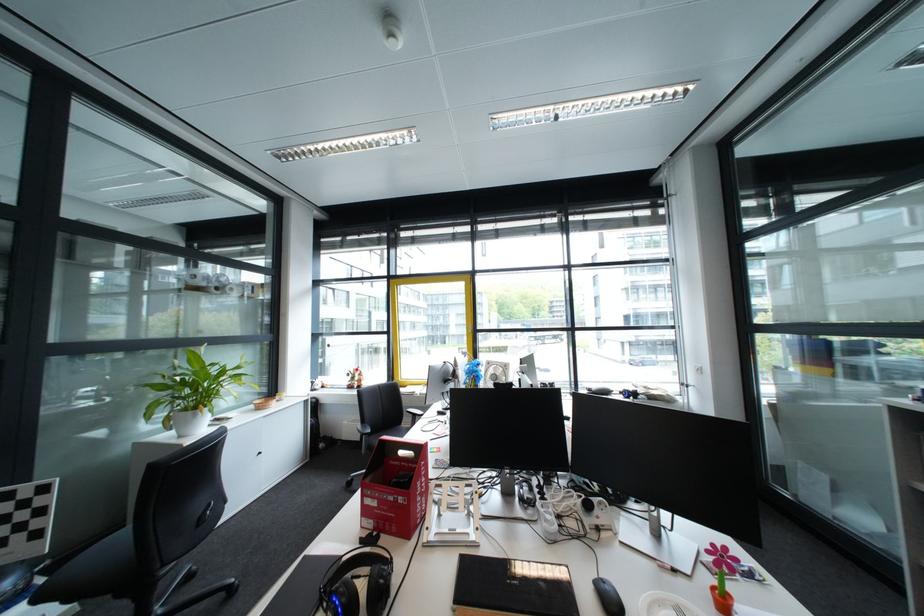
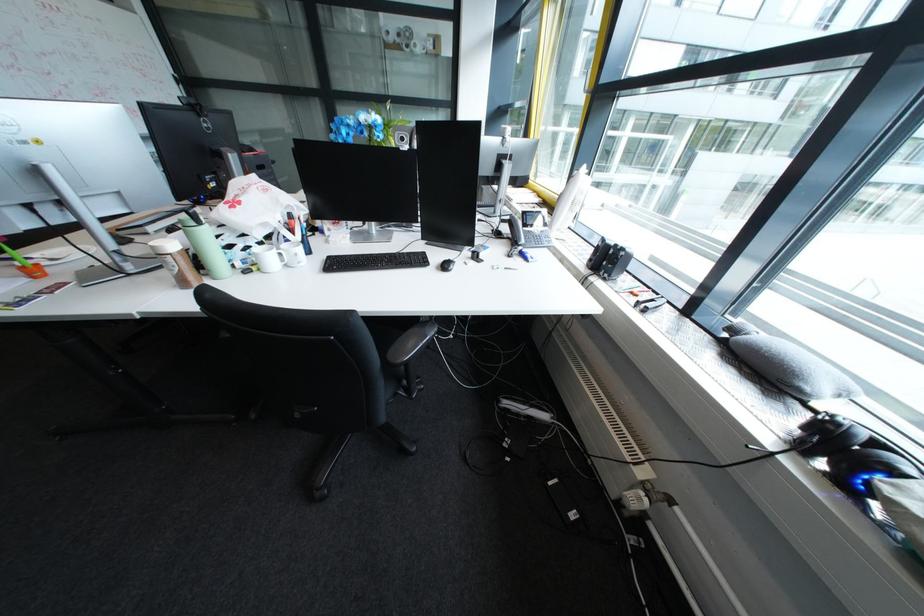
Find the pixel in the second image that matches (650,391) in the first image.

(909, 474)